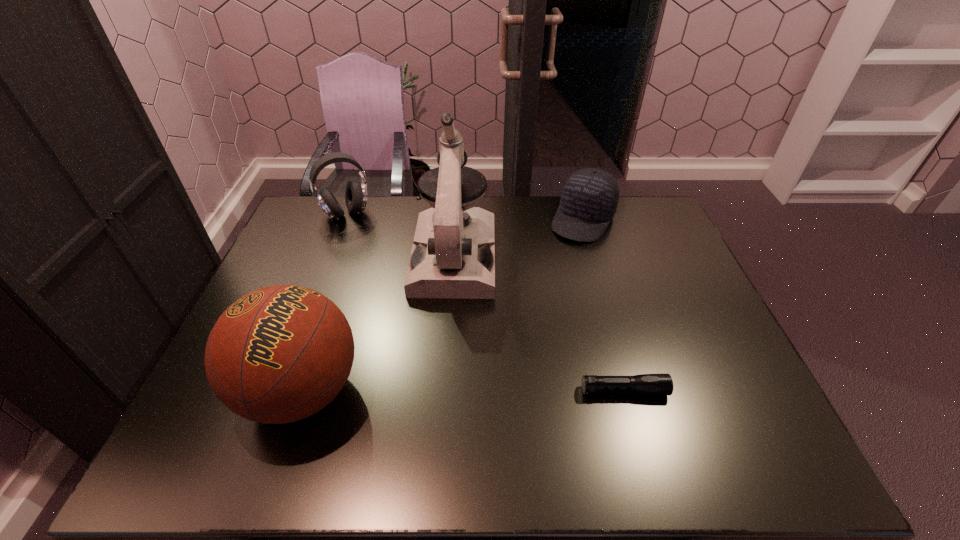
You are a GUI agent. You are given a task and a screenshot of the screen. Output one action in this format:
    pyautogui.click(x=<x>, y=<y>)
    Task: Click on the vacant space at the near right corner of the desktop
    Image resolution: width=960 pixels, height=540 pixels.
    Given the screenshot: What is the action you would take?
    pyautogui.click(x=695, y=411)

The image size is (960, 540). I want to click on unoccupied position between the basketball and the shortest object, so click(463, 390).

Image resolution: width=960 pixels, height=540 pixels. Find the location of `free space between the baseball cap and the basketball`. free space between the baseball cap and the basketball is located at coordinates (443, 305).

The height and width of the screenshot is (540, 960). In order to click on free spot between the third shortest object and the third object from left to right in this screenshot , I will do `click(400, 235)`.

Where is `vacant area between the shortest object and the third shortest object`? The width and height of the screenshot is (960, 540). vacant area between the shortest object and the third shortest object is located at coordinates (485, 302).

Locate an element on the screen. The width and height of the screenshot is (960, 540). free space between the tallest object and the shortest object is located at coordinates (539, 323).

Locate an element on the screen. The height and width of the screenshot is (540, 960). vacant area between the tallest object and the shortest object is located at coordinates (539, 323).

In order to click on vacant area between the second tallest object and the baseball cap in this screenshot , I will do `click(443, 305)`.

You are a GUI agent. You are given a task and a screenshot of the screen. Output one action in this format:
    pyautogui.click(x=<x>, y=<y>)
    Task: Click on the empty space that is in between the fourth tallest object and the third object from right to left
    
    Given the screenshot: What is the action you would take?
    pyautogui.click(x=518, y=238)

At what (x,y) coordinates should I click in order to perform the action: click on object that ranks as the closest to the third object from left to right. Please return your answer as a coordinate pair (x, y). This screenshot has height=540, width=960. Looking at the image, I should click on (279, 354).